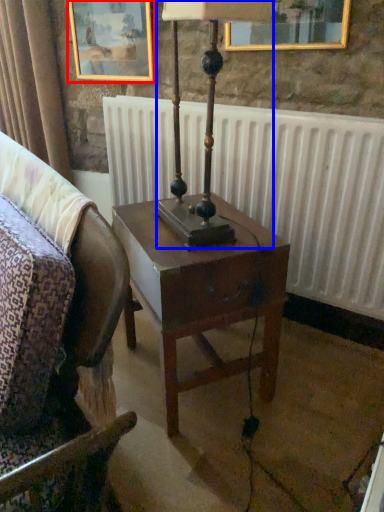
Question: Which object is further to the camera taking this photo, picture frame (highlighted by a red box) or bedside lamp (highlighted by a blue box)?

Choices:
 (A) picture frame
 (B) bedside lamp

Answer: (A)